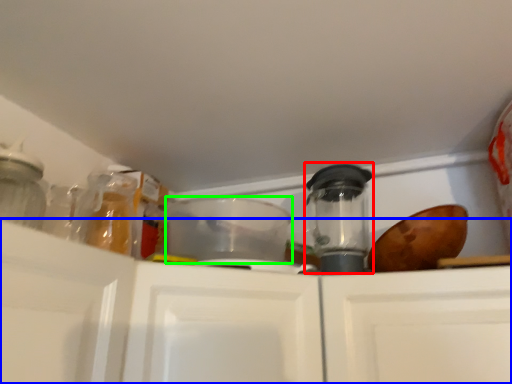
Question: Which object is the farthest from appliance (highlighted by a red box)? Choose among these: cabinetry (highlighted by a blue box) or appliance (highlighted by a green box).

Choices:
 (A) cabinetry
 (B) appliance

Answer: (A)